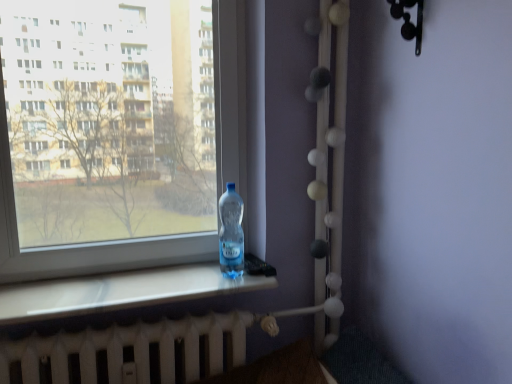
Question: Is transparent plastic bottle at left wider or thinner than transparent plastic bottle at window?

Choices:
 (A) wide
 (B) thin

Answer: (B)

Question: Is transparent plastic bottle at left taller or shorter than transparent plastic bottle at window?

Choices:
 (A) tall
 (B) short

Answer: (A)

Question: Which object is the farthest from the transparent plastic bottle at window?

Choices:
 (A) transparent plastic bottle at left
 (B) white matte radiator at bottom

Answer: (B)

Question: Estimate the real-world distances between objects in this image. Which object is closer to the transparent plastic bottle at left?

Choices:
 (A) white matte radiator at bottom
 (B) transparent plastic bottle at window

Answer: (B)